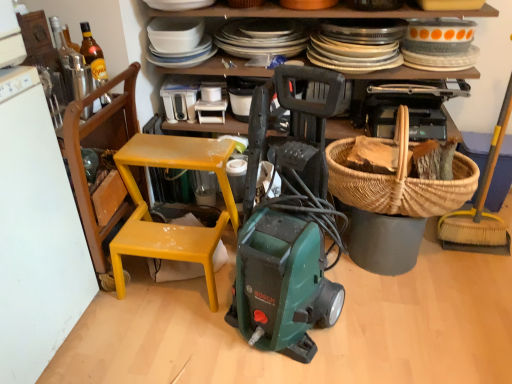
Find the location of a particular element. The height and width of the screenshot is (384, 512). free point above white plastic toaster at upper center, positioned as the 1th appliance in back-to-front order (from a real-world perspective) is located at coordinates (176, 86).